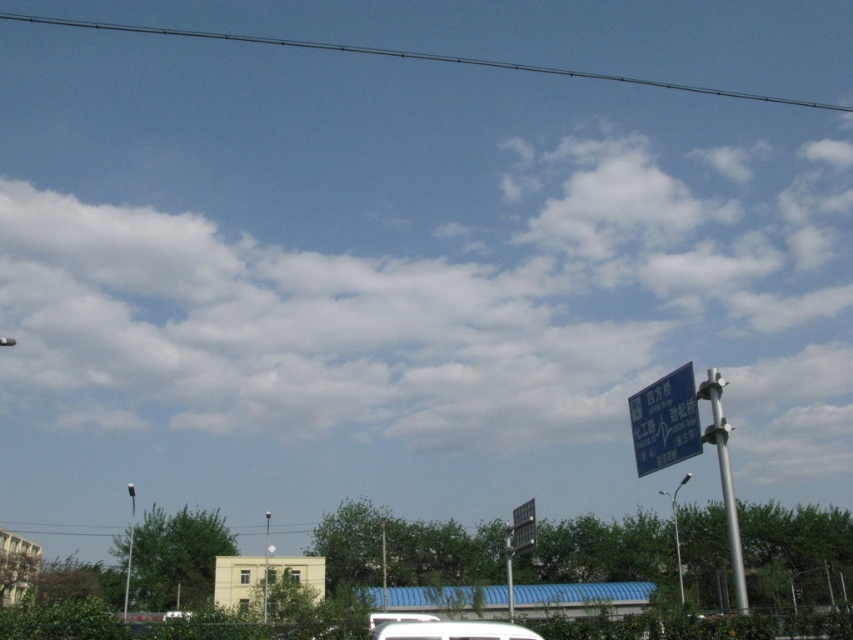
You are a delivery driver navigating through a city and need to locate the black plastic street sign at center. According to the map, the sign should be at coordinates 0.823, 0.613. Can you confirm if the sign is placed correctly?

Yes, the black plastic street sign at center is indeed located at coordinates (521,525) as per the map, so it is correctly placed.